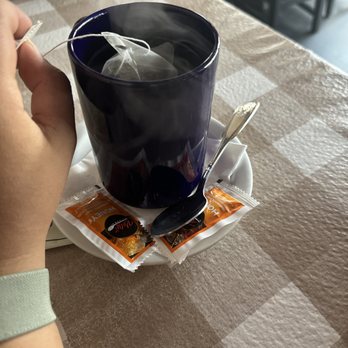
Find the location of a particular element. teacup is located at coordinates (156, 132).